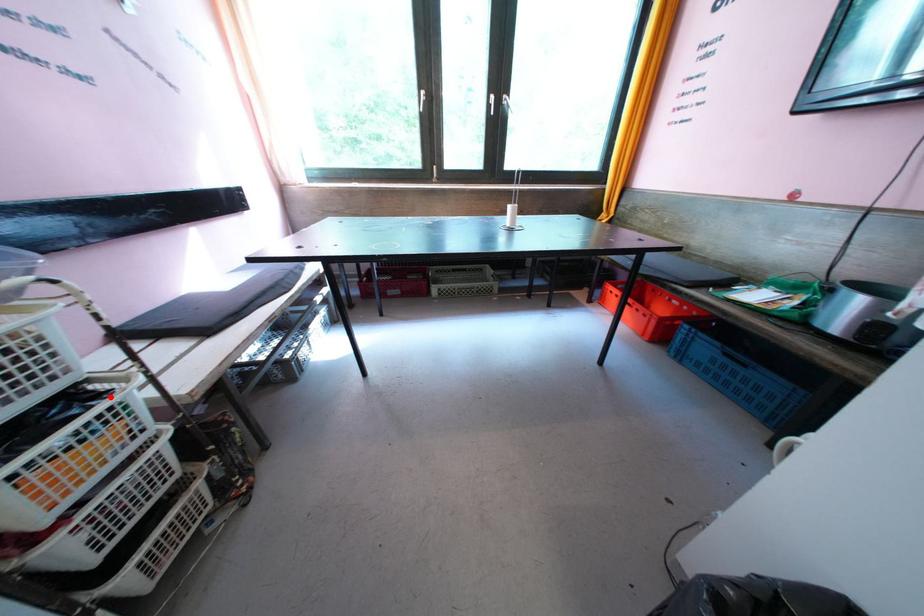
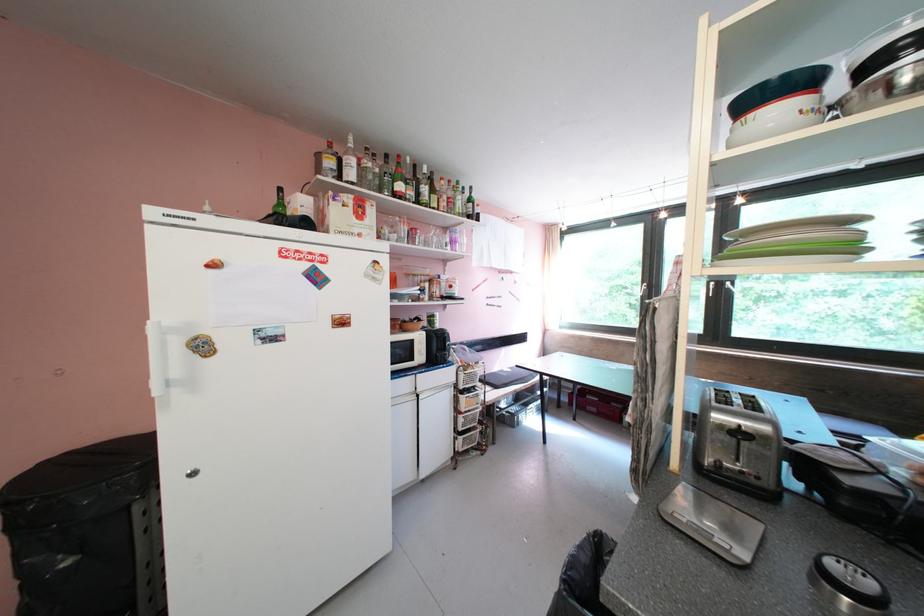
Find the pixel in the second image that matches the highlighted location in the first image.

(485, 392)